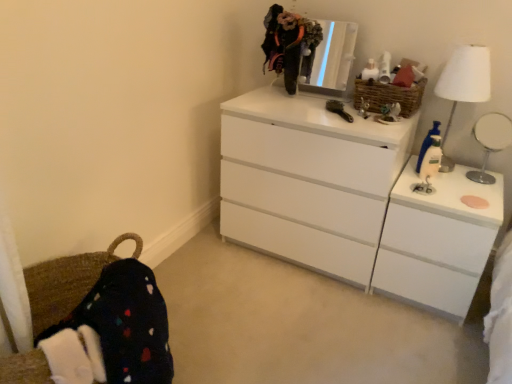
The width and height of the screenshot is (512, 384). I want to click on space that is in front of blue plastic bottle at right, so click(440, 200).